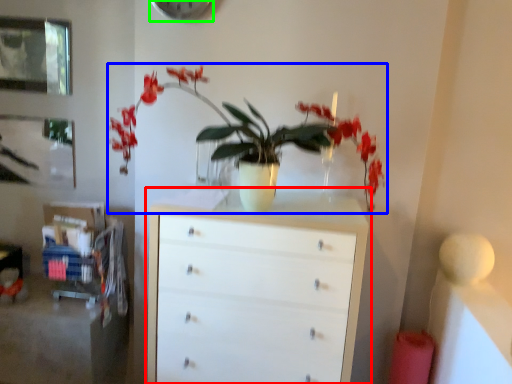
Question: Which object is positioned farthest from chest of drawers (highlighted by a red box)? Select from houseplant (highlighted by a blue box) and clock (highlighted by a green box).

Choices:
 (A) houseplant
 (B) clock

Answer: (B)